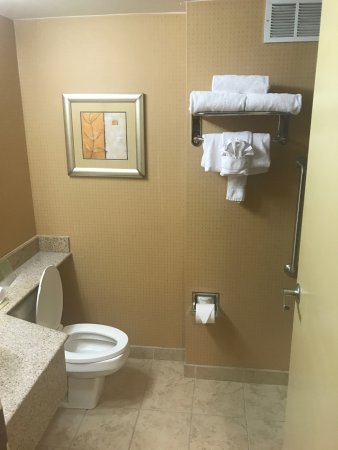
Locate an element on the screen. Image resolution: width=338 pixels, height=450 pixels. picture frame is located at coordinates (113, 96), (69, 140), (106, 173), (139, 136).